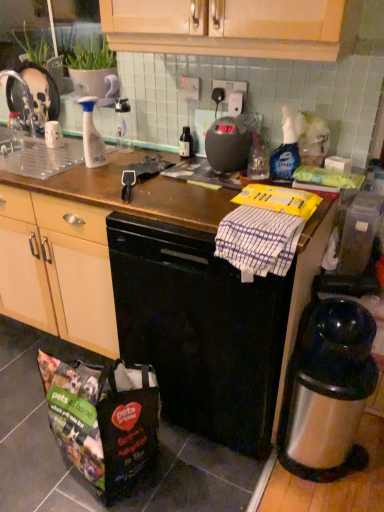
This screenshot has width=384, height=512. Find the location of `blank space above transparent plastic container at right (from a real-world perspective)`. blank space above transparent plastic container at right (from a real-world perspective) is located at coordinates (363, 192).